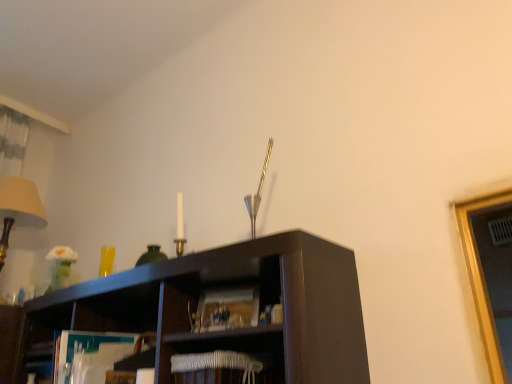
Identify the location of white corduroy cushion at lower center. [229, 340].

Describe the element at coordinates (229, 340) in the screenshot. The image size is (512, 384). I see `white corduroy cushion at lower center` at that location.

Locate an element on the screen. This screenshot has width=512, height=384. white corduroy cushion at lower center is located at coordinates (229, 340).